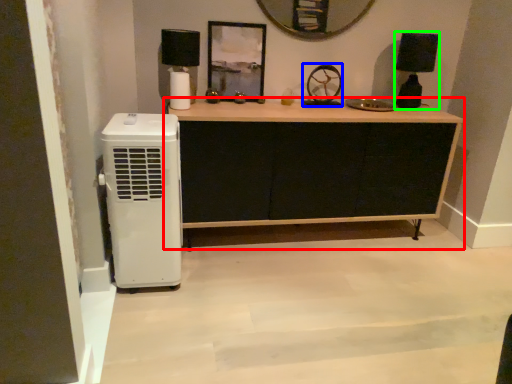
Question: Considering the real-world distances, which object is closest to chest of drawers (highlighted by a red box)? wheel (highlighted by a blue box) or lamp (highlighted by a green box).

Choices:
 (A) wheel
 (B) lamp

Answer: (A)